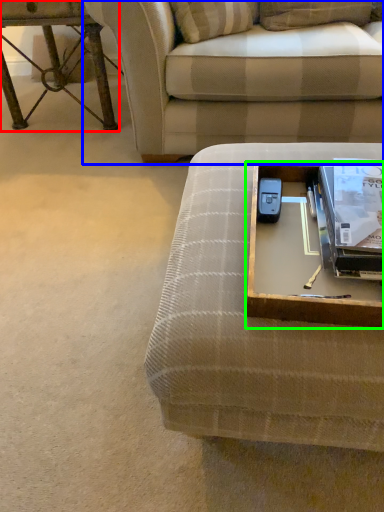
Question: Estimate the real-world distances between objects in this image. Which object is farther from table (highlighted by a red box), studio couch (highlighted by a blue box) or round table (highlighted by a green box)?

Choices:
 (A) studio couch
 (B) round table

Answer: (B)